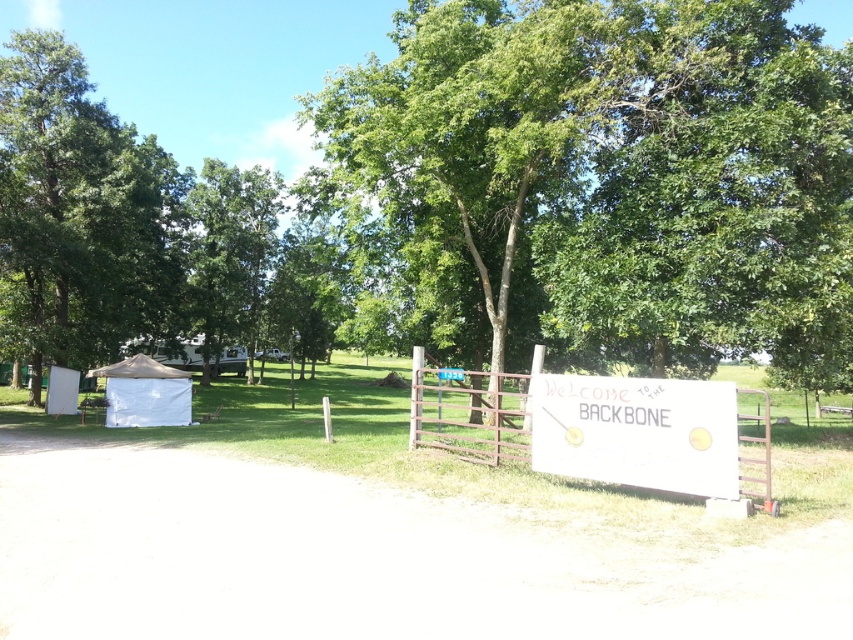
Question: Is white painted wood sign at center above metallic silver gate at center?

Choices:
 (A) no
 (B) yes

Answer: (B)

Question: Which of the following is the closest to the observer?

Choices:
 (A) (589, 81)
 (B) (566, 426)
 (C) (514, 376)

Answer: (B)

Question: Among these points, which one is nearest to the camera?

Choices:
 (A) (134, 417)
 (B) (445, 33)
 (C) (585, 467)
 (D) (741, 456)

Answer: (C)

Question: Is green leafy tree at left to the right of white painted wood sign at center from the viewer's perspective?

Choices:
 (A) yes
 (B) no

Answer: (B)

Question: Which point is closer to the camera?

Choices:
 (A) (717, 51)
 (B) (494, 449)
 (C) (48, 141)
 (D) (567, 378)

Answer: (D)

Question: Can you confirm if green leafy tree at center is wider than metallic silver gate at center?

Choices:
 (A) yes
 (B) no

Answer: (A)